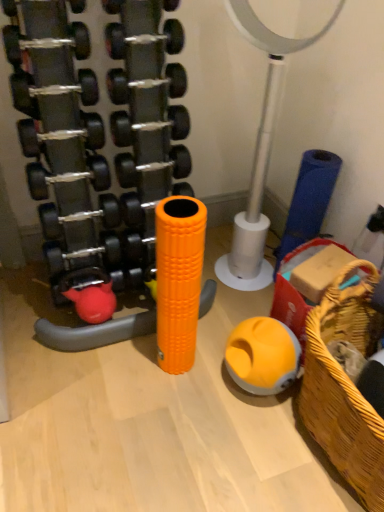
At what (x,y) coordinates should I click in order to perform the action: click on vacant area that lies to the right of orange foam roller at center, the 2th toy positioned from the right. Please return your answer as a coordinate pair (x, y). The height and width of the screenshot is (512, 384). Looking at the image, I should click on (215, 358).